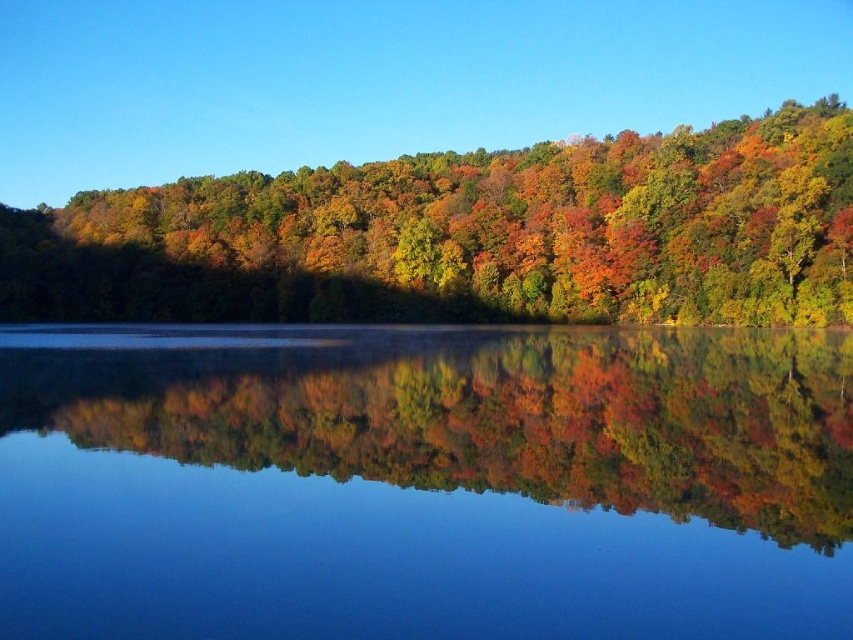
You are an artist trying to paint the scene. You notice that the smooth glass water at center and autumn leaves at center are both at the center. Which one is closer to the viewer?

The smooth glass water at center is positioned under autumn leaves at center, so the autumn leaves at center are closer to the viewer.

You are an artist trying to capture the scene. You notice the smooth glass water at center and autumn leaves at center. Which object would you need to paint with more detail because it appears smaller in the image?

The smooth glass water at center has a smaller size compared to autumn leaves at center, so you would need to paint the smooth glass water at center with more detail due to its smaller size.